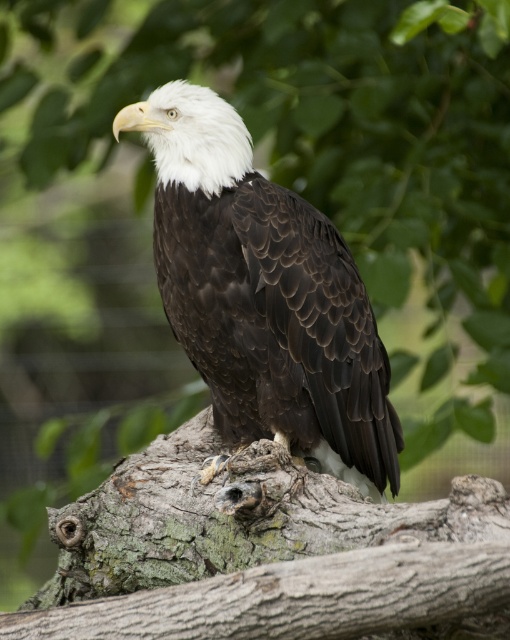
Who is more distant from viewer, (495, 515) or (255, 195)?

The point (255, 195) is more distant.

Is rough bark tree trunk at center smaller than dark brown feathers at center?

Actually, rough bark tree trunk at center might be larger than dark brown feathers at center.

Between point (27, 608) and point (228, 163), which one is positioned in front?

Point (228, 163) is in front.

This screenshot has height=640, width=510. Find the location of `rough bark tree trunk at center`. rough bark tree trunk at center is located at coordinates (267, 554).